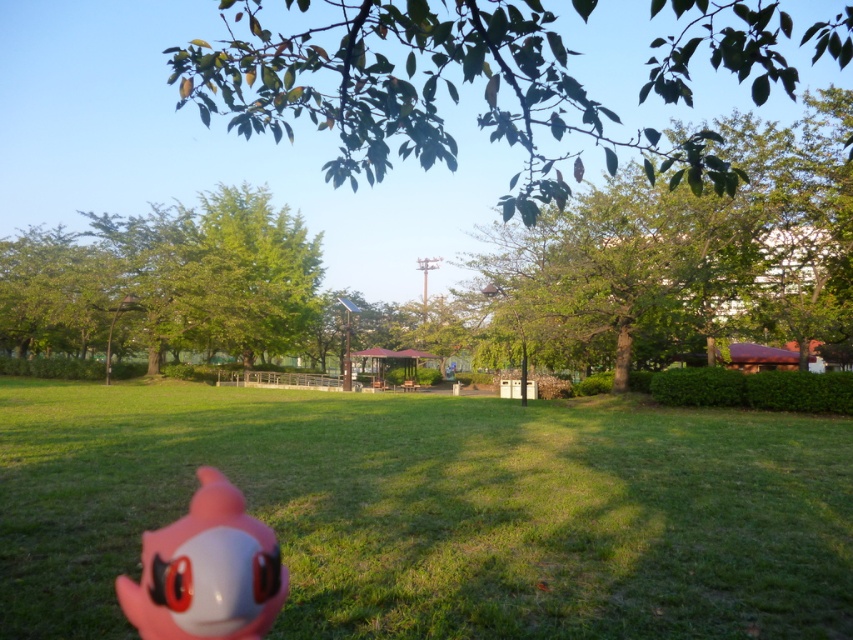
Question: Considering the real-world distances, which object is closest to the pink rubber toy at center?

Choices:
 (A) green leafy tree at upper right
 (B) pink rubber toy at lower left
 (C) green leafy tree at center

Answer: (A)

Question: Considering the relative positions of green leafy tree at upper right and green leafy tree at center in the image provided, where is green leafy tree at upper right located with respect to green leafy tree at center?

Choices:
 (A) right
 (B) left

Answer: (A)

Question: Which point is closer to the camera?

Choices:
 (A) pink rubber toy at center
 (B) green leafy tree at center
 (C) pink rubber toy at lower left

Answer: (C)

Question: Which of the following is the farthest from the observer?

Choices:
 (A) (816, 220)
 (B) (463, 36)
 (C) (312, 307)

Answer: (C)

Question: Is green glossy leaves at upper center in front of green leafy tree at center?

Choices:
 (A) yes
 (B) no

Answer: (A)

Question: Is pink rubber toy at center above green leafy tree at center?

Choices:
 (A) yes
 (B) no

Answer: (B)